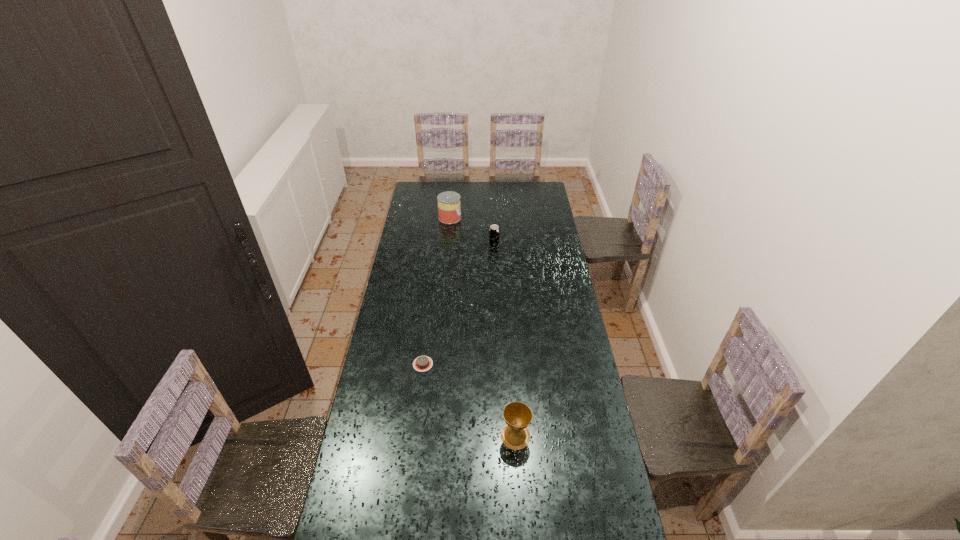
The width and height of the screenshot is (960, 540). Find the location of `can`. can is located at coordinates (449, 207).

The width and height of the screenshot is (960, 540). Identify the location of chalice. (515, 435).

Image resolution: width=960 pixels, height=540 pixels. I want to click on the third nearest object, so click(494, 231).

Find the location of a particular element. This screenshot has height=540, width=960. the second nearest object is located at coordinates (423, 363).

Find the location of a particular element. The width and height of the screenshot is (960, 540). the shortest object is located at coordinates (423, 363).

Locate an element on the screen. The width and height of the screenshot is (960, 540). vacant space located on the front of the farthest object is located at coordinates (446, 253).

Locate an element on the screen. This screenshot has width=960, height=540. vacant space situated on the front of the chalice is located at coordinates (520, 518).

Identify the location of free space located on the front of the soda can. click(496, 293).

What are the coordinates of `free space located on the right of the second nearest object` in the screenshot? It's located at (463, 364).

I want to click on vacant region at the far edge of the desktop, so click(x=499, y=193).